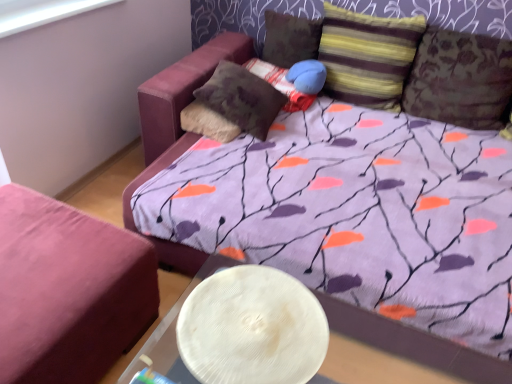
Question: From a real-world perspective, is velvet pink ottoman at lower left physically below striped fabric pillow at upper right, the fourth pillow in the left-to-right sequence?

Choices:
 (A) yes
 (B) no

Answer: (A)

Question: Is velvet pink ottoman at lower left aimed at striped fabric pillow at upper right, the second pillow viewed from the right?

Choices:
 (A) yes
 (B) no

Answer: (B)

Question: Is velvet pink ottoman at lower left thinner than striped fabric pillow at upper right, the fourth pillow in the left-to-right sequence?

Choices:
 (A) no
 (B) yes

Answer: (A)

Question: Is velvet pink ottoman at lower left to the left of striped fabric pillow at upper right, the second pillow viewed from the right, from the viewer's perspective?

Choices:
 (A) no
 (B) yes

Answer: (B)

Question: From a real-world perspective, is velvet pink ottoman at lower left positioned over striped fabric pillow at upper right, the fourth pillow in the left-to-right sequence, based on gravity?

Choices:
 (A) no
 (B) yes

Answer: (A)

Question: Can you confirm if velvet pink ottoman at lower left is smaller than striped fabric pillow at upper right, the fourth pillow in the left-to-right sequence?

Choices:
 (A) no
 (B) yes

Answer: (A)

Question: Is textured brown pillow at upper right, placed as the first pillow when sorted from right to left, at the left side of striped fabric pillow at upper right, the fourth pillow in the left-to-right sequence?

Choices:
 (A) no
 (B) yes

Answer: (A)

Question: Is textured brown pillow at upper right, placed as the first pillow when sorted from right to left, outside of striped fabric pillow at upper right, the fourth pillow in the left-to-right sequence?

Choices:
 (A) no
 (B) yes

Answer: (B)

Question: Is textured brown pillow at upper right, the fifth pillow when ordered from left to right, beside striped fabric pillow at upper right, the fourth pillow in the left-to-right sequence?

Choices:
 (A) no
 (B) yes

Answer: (A)

Question: From a real-world perspective, is textured brown pillow at upper right, the fifth pillow when ordered from left to right, located higher than striped fabric pillow at upper right, the fourth pillow in the left-to-right sequence?

Choices:
 (A) yes
 (B) no

Answer: (B)

Question: Is textured brown pillow at upper right, the fifth pillow when ordered from left to right, not close to striped fabric pillow at upper right, the fourth pillow in the left-to-right sequence?

Choices:
 (A) no
 (B) yes

Answer: (A)

Question: Is striped fabric pillow at upper right, the second pillow viewed from the right, surrounded by textured brown pillow at upper right, placed as the first pillow when sorted from right to left?

Choices:
 (A) yes
 (B) no

Answer: (B)

Question: From a real-world perspective, is striped fabric pillow at upper right, the second pillow viewed from the right, positioned under textured brown pillow at upper right, placed as the first pillow when sorted from right to left, based on gravity?

Choices:
 (A) no
 (B) yes

Answer: (A)